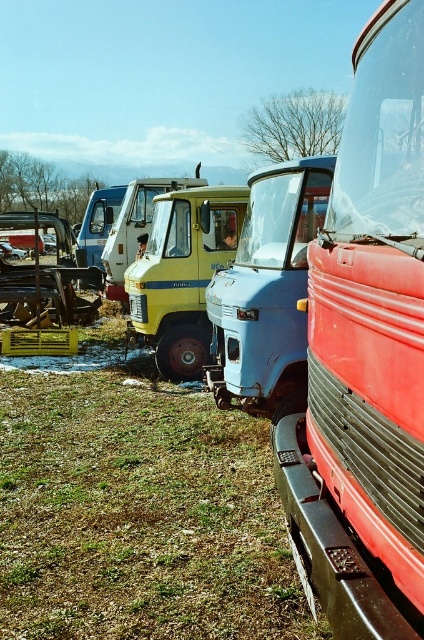
You are standing in the middle of the grassy area with snow patches and see the point at coordinates (x=365, y=355). Which object is this point located on?

The point at coordinates (x=365, y=355) is located on the matte blue truck at center.

In the scene shown: What are the coordinates of the matte blue truck at center?

The coordinates of the matte blue truck at center are at point (365, 355).

You are a photographer planning to take a photo of the matte blue truck at center and the wooden frame at left. Based on their heights, which object should you position closer to the camera to ensure both are fully visible in the frame?

Since the matte blue truck at center is shorter than the wooden frame at left, you should position the wooden frame at left closer to the camera to ensure both are fully visible in the frame.